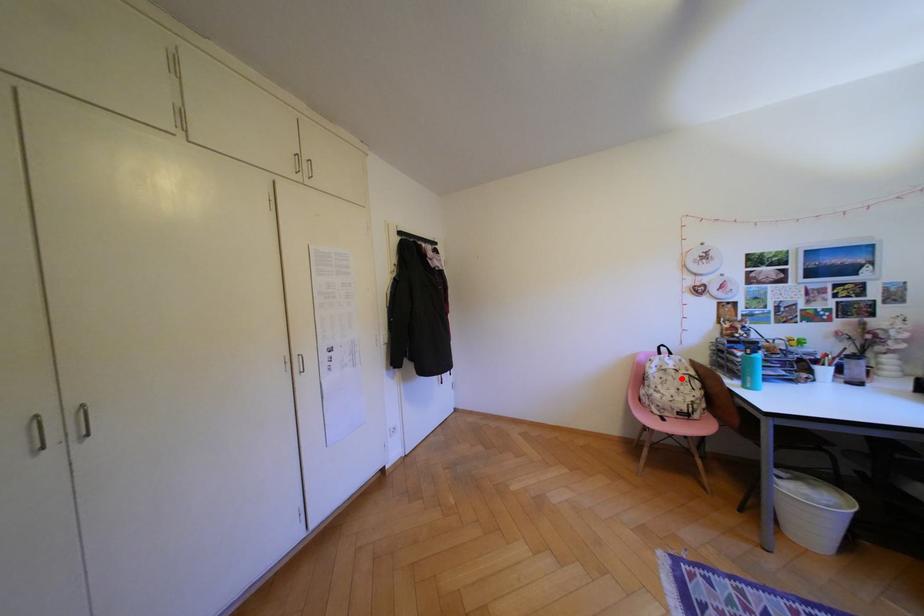
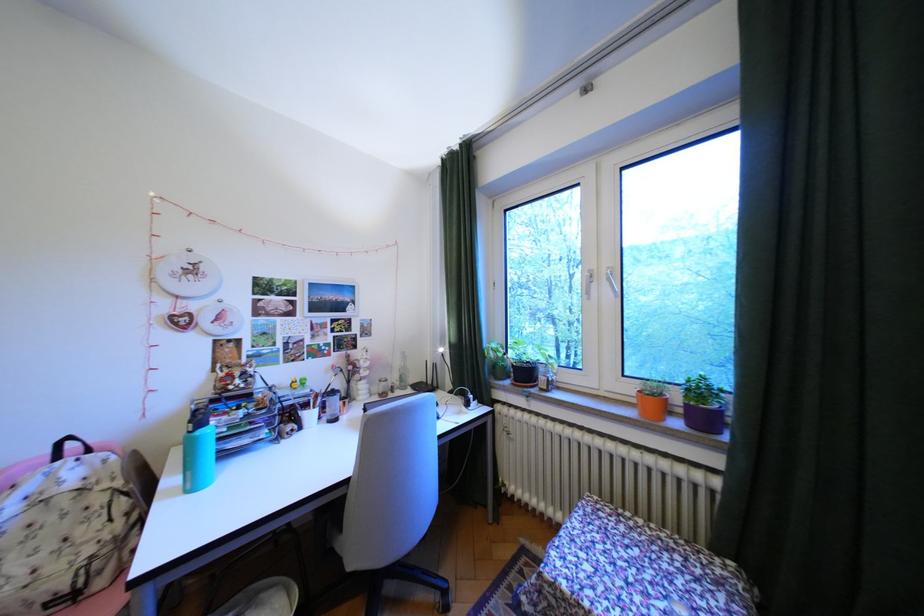
The point at the highlighted location is marked in the first image. Where is the corresponding point in the second image?

(65, 519)